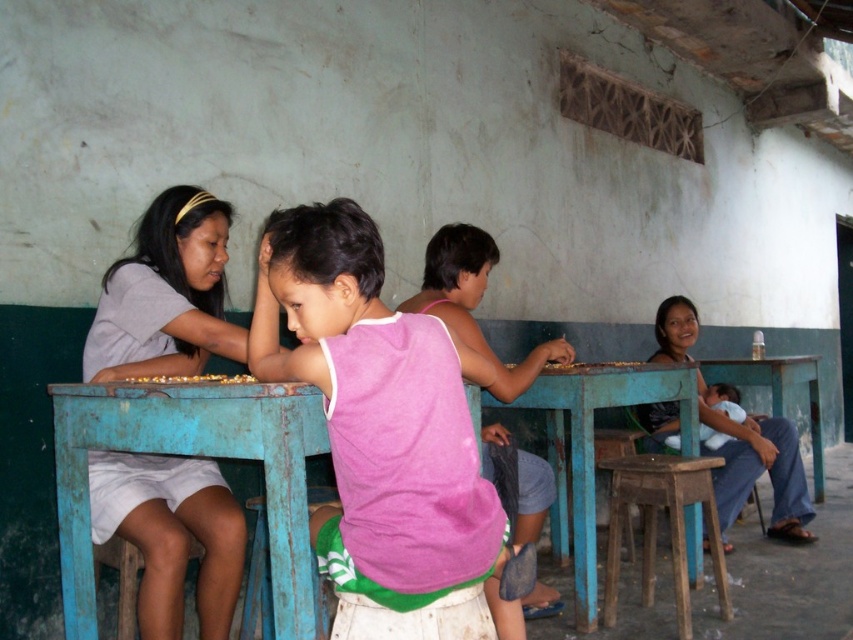
Question: Does rusty wood stool at lower center have a greater width compared to wooden stool at lower left?

Choices:
 (A) no
 (B) yes

Answer: (A)

Question: Does gray matte shirt at left appear over wooden stool at lower center?

Choices:
 (A) no
 (B) yes

Answer: (B)

Question: Which of the following is the closest to the observer?

Choices:
 (A) pink fabric shirt at center
 (B) blue painted wood table at left
 (C) wooden stool at lower center

Answer: (B)

Question: Estimate the real-world distances between objects in this image. Which object is closer to the pink fabric shirt at right?

Choices:
 (A) blue painted wood table at left
 (B) wooden stool at lower center

Answer: (B)

Question: Is gray matte shirt at left bigger than blue painted wood table at center?

Choices:
 (A) no
 (B) yes

Answer: (A)

Question: Which point is farther to the camera?

Choices:
 (A) (248, 582)
 (B) (132, 614)

Answer: (A)